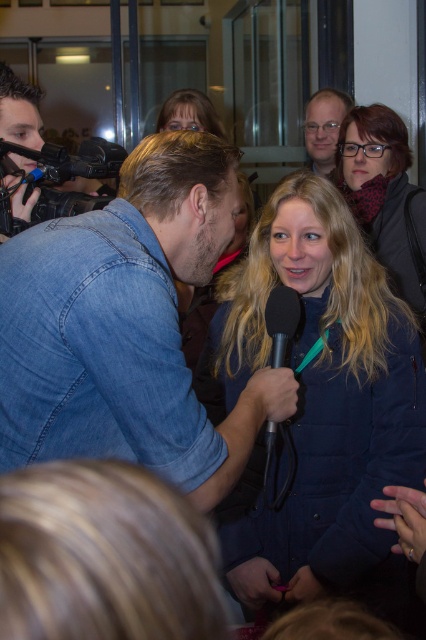
Is black plastic video camera at upper left positioned at the back of matte blue shirt at upper center?

No, black plastic video camera at upper left is closer to the viewer.

The image size is (426, 640). What do you see at coordinates (66, 173) in the screenshot?
I see `black plastic video camera at upper left` at bounding box center [66, 173].

Who is more forward, (x=69, y=195) or (x=336, y=140)?

Point (x=69, y=195)

You are a GUI agent. You are given a task and a screenshot of the screen. Output one action in this format:
    pyautogui.click(x=<x>, y=<y>)
    Task: Click on the black plastic video camera at upper left
    The image size is (426, 640).
    Given the screenshot: What is the action you would take?
    pyautogui.click(x=66, y=173)

Between denim jacket at center and matte blue shirt at upper center, which one appears on the left side from the viewer's perspective?

From the viewer's perspective, denim jacket at center appears more on the left side.

Is denim jacket at center wider than matte blue shirt at upper center?

Yes, denim jacket at center is wider than matte blue shirt at upper center.

Who is more distant from viewer, [36,388] or [328,97]?

Positioned behind is point [328,97].

Locate an element on the screen. denim jacket at center is located at coordinates (126, 326).

Does matte blue coat at center lie behind matte black hair at upper center?

No, matte blue coat at center is closer to the viewer.

Is matte blue coat at center to the left of matte black hair at upper center from the viewer's perspective?

No, matte blue coat at center is not to the left of matte black hair at upper center.

Who is more distant from viewer, (327, 378) or (198, 109)?

The point (198, 109) is more distant.

This screenshot has height=640, width=426. What are the coordinates of `matte blue coat at center` in the screenshot? It's located at (317, 404).